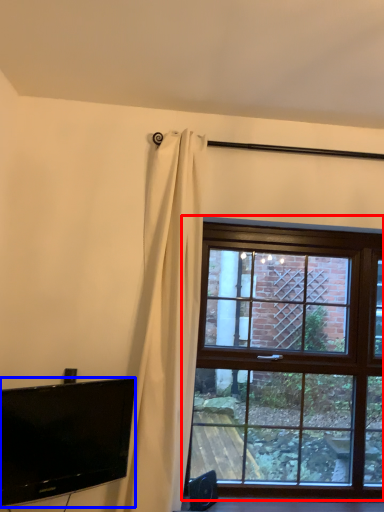
Question: Among these objects, which one is farthest to the camera, window (highlighted by a red box) or television (highlighted by a blue box)?

Choices:
 (A) window
 (B) television

Answer: (A)